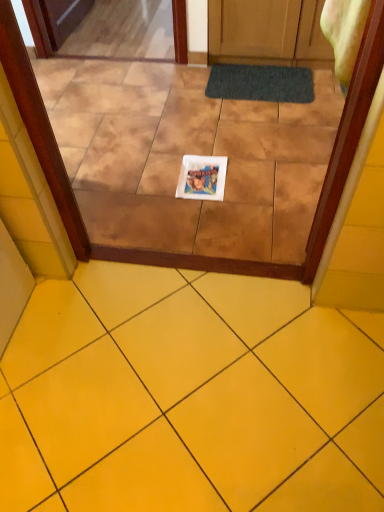
Question: From a real-world perspective, is transparent glass door at center positioned above or below dark gray textured bath mat at center?

Choices:
 (A) below
 (B) above

Answer: (A)

Question: From the image's perspective, is transparent glass door at center positioned above or below dark gray textured bath mat at center?

Choices:
 (A) below
 (B) above

Answer: (A)

Question: Estimate the real-world distances between objects in this image. Which object is farther from the yellow ceramic tile at lower center?

Choices:
 (A) transparent glass door at center
 (B) dark gray textured bath mat at center
 (C) white paper at center

Answer: (B)

Question: Considering the real-world distances, which object is farthest from the transparent glass door at center?

Choices:
 (A) yellow ceramic tile at lower center
 (B) white paper at center
 (C) dark gray textured bath mat at center

Answer: (C)